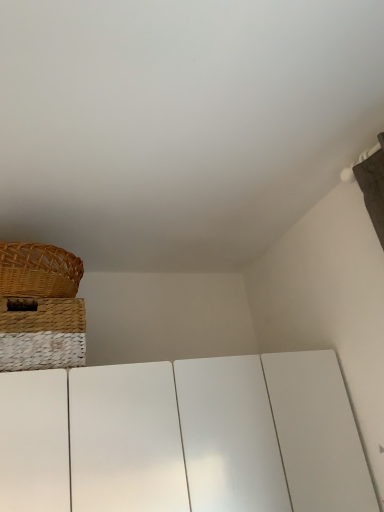
Where is `woven straw basket at upper left`? This screenshot has width=384, height=512. woven straw basket at upper left is located at coordinates (42, 333).

What do you see at coordinates (42, 333) in the screenshot? I see `woven straw basket at upper left` at bounding box center [42, 333].

Describe the element at coordinates (38, 271) in the screenshot. I see `woven brown picnic basket at upper left` at that location.

This screenshot has width=384, height=512. Find the location of `woven brown picnic basket at upper left`. woven brown picnic basket at upper left is located at coordinates (38, 271).

Find the location of a particular element. The width and height of the screenshot is (384, 512). woven straw basket at upper left is located at coordinates (42, 333).

Considering the relative positions of woven straw basket at upper left and woven brown picnic basket at upper left in the image provided, is woven straw basket at upper left to the left or to the right of woven brown picnic basket at upper left?

In the image, woven straw basket at upper left appears on the right side of woven brown picnic basket at upper left.

Which object is closer to the camera taking this photo, woven straw basket at upper left or woven brown picnic basket at upper left?

woven straw basket at upper left.

Considering the positions of points (30, 329) and (75, 285), is point (30, 329) farther from camera compared to point (75, 285)?

No.

Based on the photo, from the image's perspective, is woven straw basket at upper left located above woven brown picnic basket at upper left?

No.

From a real-world perspective, is woven straw basket at upper left under woven brown picnic basket at upper left?

Indeed, from a real-world perspective, woven straw basket at upper left is positioned beneath woven brown picnic basket at upper left.

Considering the sizes of objects woven straw basket at upper left and woven brown picnic basket at upper left in the image provided, who is thinner, woven straw basket at upper left or woven brown picnic basket at upper left?

woven brown picnic basket at upper left.

Is woven straw basket at upper left shorter than woven brown picnic basket at upper left?

In fact, woven straw basket at upper left may be taller than woven brown picnic basket at upper left.

Which of these two, woven straw basket at upper left or woven brown picnic basket at upper left, is smaller?

woven brown picnic basket at upper left.

Is woven brown picnic basket at upper left inside woven straw basket at upper left?

Actually, woven brown picnic basket at upper left is outside woven straw basket at upper left.

Is woven straw basket at upper left not near woven brown picnic basket at upper left?

No.

Is woven brown picnic basket at upper left at the back of woven straw basket at upper left?

woven straw basket at upper left does not have its back to woven brown picnic basket at upper left.

In the scene shown: How different are the orientations of woven straw basket at upper left and woven brown picnic basket at upper left in degrees?

They differ by 0.000816 degrees in their facing directions.

The width and height of the screenshot is (384, 512). I want to click on picnic basket on the left of the woven straw basket at upper left, so click(38, 271).

Between woven brown picnic basket at upper left and woven straw basket at upper left, which one appears on the left side from the viewer's perspective?

From the viewer's perspective, woven brown picnic basket at upper left appears more on the left side.

Is the depth of woven brown picnic basket at upper left greater than that of woven straw basket at upper left?

Yes, it is.

Is point (62, 295) closer to viewer compared to point (36, 333)?

No, (62, 295) is behind (36, 333).

Looking at this image, from the image's perspective, would you say woven brown picnic basket at upper left is positioned over woven straw basket at upper left?

Yes, from the image's perspective, woven brown picnic basket at upper left is above woven straw basket at upper left.

From a real-world perspective, is woven brown picnic basket at upper left over woven straw basket at upper left?

Correct, in the physical world, woven brown picnic basket at upper left is higher than woven straw basket at upper left.

Considering the sizes of woven brown picnic basket at upper left and woven straw basket at upper left in the image, is woven brown picnic basket at upper left wider or thinner than woven straw basket at upper left?

Considering their sizes, woven brown picnic basket at upper left looks slimmer than woven straw basket at upper left.

Considering the relative sizes of woven brown picnic basket at upper left and woven straw basket at upper left in the image provided, is woven brown picnic basket at upper left shorter than woven straw basket at upper left?

Correct, woven brown picnic basket at upper left is not as tall as woven straw basket at upper left.

Considering the relative sizes of woven brown picnic basket at upper left and woven straw basket at upper left in the image provided, is woven brown picnic basket at upper left smaller than woven straw basket at upper left?

Correct, woven brown picnic basket at upper left occupies less space than woven straw basket at upper left.

Looking at this image, would you say woven brown picnic basket at upper left is inside or outside woven straw basket at upper left?

woven brown picnic basket at upper left exists outside the volume of woven straw basket at upper left.

Is woven brown picnic basket at upper left next to woven straw basket at upper left?

No.

From the picture: Does woven brown picnic basket at upper left turn towards woven straw basket at upper left?

No, woven brown picnic basket at upper left is not oriented towards woven straw basket at upper left.

How far apart are woven brown picnic basket at upper left and woven straw basket at upper left?

4.24 inches.

Identify the location of basket below the woven brown picnic basket at upper left (from a real-world perspective). This screenshot has height=512, width=384. (42, 333).

Find the location of a particular element. The width and height of the screenshot is (384, 512). basket to the right of woven brown picnic basket at upper left is located at coordinates (42, 333).

The width and height of the screenshot is (384, 512). Identify the location of picnic basket above the woven straw basket at upper left (from the image's perspective). (38, 271).